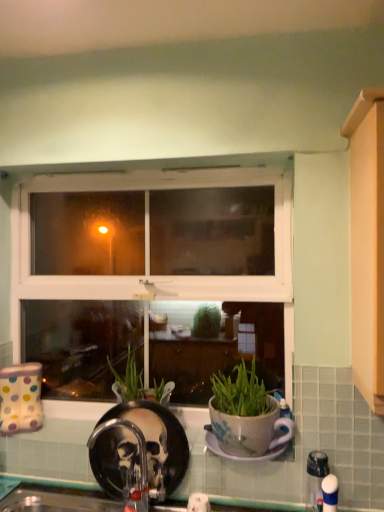
Question: From the image's perspective, is black matte faucet at lower center, the 2th faucet positioned from the right, positioned above or below porcelain plate at center?

Choices:
 (A) below
 (B) above

Answer: (A)

Question: In terms of size, does black matte faucet at lower center, the 1th faucet from the back, appear bigger or smaller than porcelain plate at center?

Choices:
 (A) small
 (B) big

Answer: (B)

Question: Which object is positioned closest to the black matte faucet at lower center, the 1th faucet positioned from the left?

Choices:
 (A) porcelain plate at center
 (B) white plastic faucet at lower right, arranged as the 2th faucet when viewed from the back
 (C) white plastic window at center

Answer: (A)

Question: Considering the real-world distances, which object is farthest from the porcelain plate at center?

Choices:
 (A) black matte faucet at lower center, the 2th faucet positioned from the right
 (B) white plastic window at center
 (C) white plastic faucet at lower right, which is the 1th faucet in front-to-back order

Answer: (B)